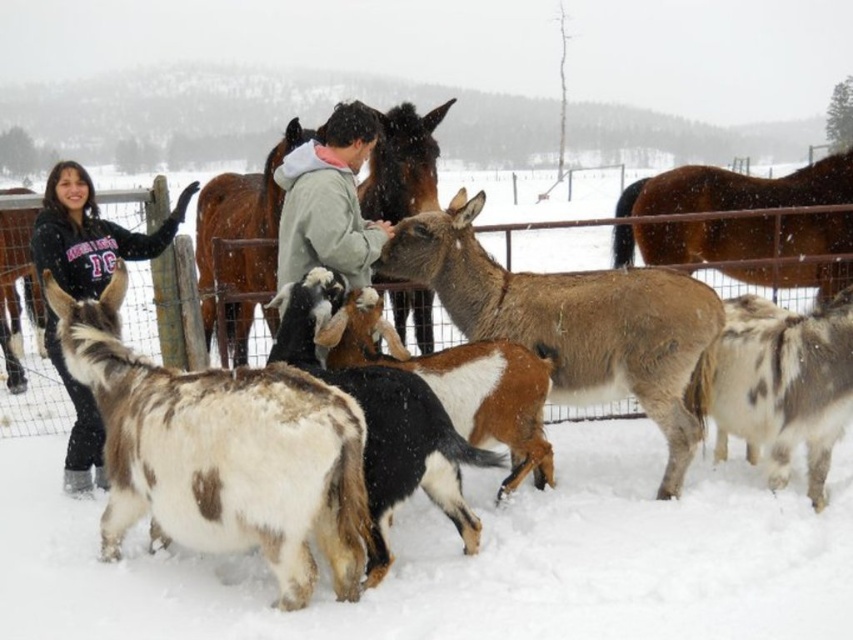
Between spotted fur goat at center and gray fleece jacket at center, which one has more height?

With more height is spotted fur goat at center.

Does spotted fur goat at center have a lesser height compared to gray fleece jacket at center?

No.

Identify the location of spotted fur goat at center. (383, 420).

Image resolution: width=853 pixels, height=640 pixels. What are the coordinates of `spotted fur goat at center` in the screenshot? It's located at (383, 420).

Looking at this image, who is more forward, (531, 429) or (74, 248)?

Positioned in front is point (531, 429).

Does brown speckled fur at center have a greater width compared to black fleece jacket at left?

Yes.

Between point (332, 342) and point (38, 257), which one is positioned behind?

Point (38, 257)

You are a GUI agent. You are given a task and a screenshot of the screen. Output one action in this format:
    pyautogui.click(x=<x>, y=<y>)
    Task: Click on the brown speckled fur at center
    The height and width of the screenshot is (640, 853).
    Given the screenshot: What is the action you would take?
    pyautogui.click(x=459, y=381)

Does brown and white fur goat at center have a lesser height compared to brown glossy horse at upper right?

No.

Is brown and white fur goat at center bigger than brown glossy horse at upper right?

Incorrect, brown and white fur goat at center is not larger than brown glossy horse at upper right.

Which is behind, point (302, 474) or point (804, 230)?

Point (804, 230)

Locate an element on the screen. Image resolution: width=853 pixels, height=640 pixels. brown and white fur goat at center is located at coordinates (221, 452).